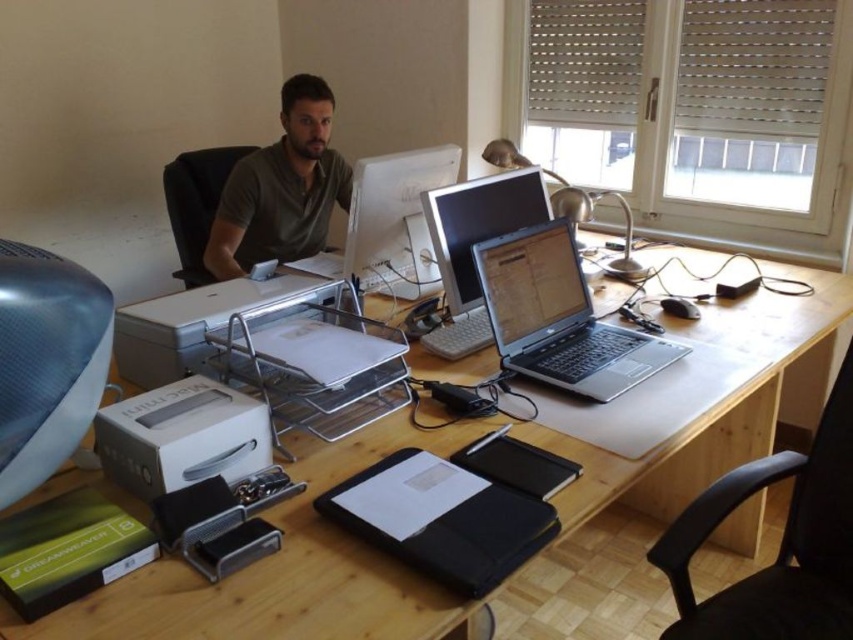
Question: Which point is closer to the camera taking this photo?

Choices:
 (A) (199, 323)
 (B) (526, 353)
 (C) (259, 211)

Answer: (A)

Question: Which object appears farthest from the camera in this image?

Choices:
 (A) black leather chair at lower right
 (B) white plastic printer at lower left

Answer: (A)

Question: Which of the following is the farthest from the observer?

Choices:
 (A) black leather chair at lower right
 (B) green matte shirt at center
 (C) silver/black laptop at center

Answer: (B)

Question: Can you confirm if silver/black laptop at center is positioned to the right of green matte shirt at center?

Choices:
 (A) no
 (B) yes

Answer: (B)

Question: Can you confirm if wooden desk at center is thinner than matte white printer at center?

Choices:
 (A) yes
 (B) no

Answer: (B)

Question: Does wooden desk at center have a greater width compared to black leather chair at lower right?

Choices:
 (A) no
 (B) yes

Answer: (B)